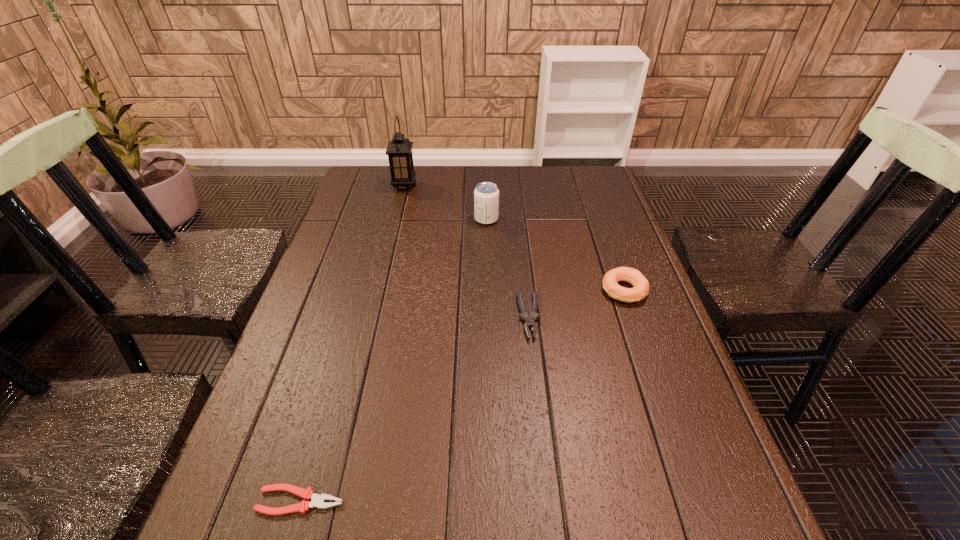
At what (x,y) coordinates should I click in order to perform the action: click on free spot located on the back of the farthest object. Please return your answer as a coordinate pair (x, y). The height and width of the screenshot is (540, 960). Looking at the image, I should click on (408, 172).

You are a GUI agent. You are given a task and a screenshot of the screen. Output one action in this format:
    pyautogui.click(x=<x>, y=<y>)
    Task: Click on the vacant position located 0.290m on the right of the fourth shortest object
    The width and height of the screenshot is (960, 540).
    Given the screenshot: What is the action you would take?
    pyautogui.click(x=591, y=219)

The height and width of the screenshot is (540, 960). Identify the location of vacant space located 0.120m on the front of the third shortest object. (643, 345).

You are a GUI agent. You are given a task and a screenshot of the screen. Output one action in this format:
    pyautogui.click(x=<x>, y=<y>)
    Task: Click on the vacant area located at the gripping part of the second shortest object
    This screenshot has height=540, width=960.
    Given the screenshot: What is the action you would take?
    pyautogui.click(x=542, y=435)

Locate an element on the screen. Image resolution: width=960 pixels, height=540 pixels. blank area located 0.250m on the back of the left pliers is located at coordinates (339, 368).

Find the location of `object at the far edge`. object at the far edge is located at coordinates (399, 150).

Identify the location of lantern positioned at the left edge. (399, 150).

Locate an element on the screen. pliers located in the left edge section of the desktop is located at coordinates click(318, 501).

Image resolution: width=960 pixels, height=540 pixels. In order to click on object at the right edge in this screenshot , I will do `click(640, 290)`.

Image resolution: width=960 pixels, height=540 pixels. What are the coordinates of `object situated at the far left corner` in the screenshot? It's located at pyautogui.click(x=399, y=150).